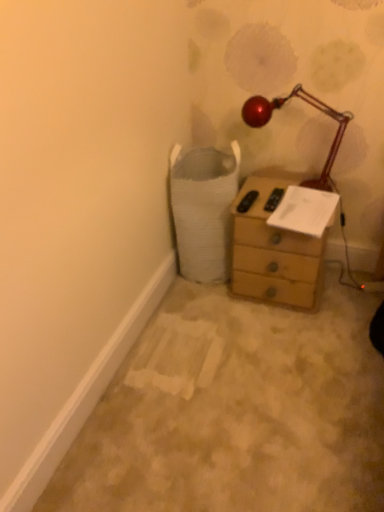
Question: In terms of width, does wooden chest of drawers at center look wider or thinner when compared to metallic red lamp at upper right?

Choices:
 (A) wide
 (B) thin

Answer: (A)

Question: Based on their sizes in the image, would you say wooden chest of drawers at center is bigger or smaller than metallic red lamp at upper right?

Choices:
 (A) small
 (B) big

Answer: (B)

Question: Which is nearer to the white paper at upper right?

Choices:
 (A) wooden chest of drawers at center
 (B) metallic red lamp at upper right

Answer: (A)

Question: Estimate the real-world distances between objects in this image. Which object is closer to the wooden chest of drawers at center?

Choices:
 (A) white paper at upper right
 (B) metallic red lamp at upper right

Answer: (A)